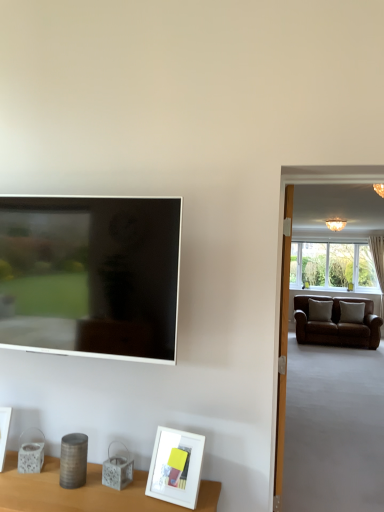
Question: Can you confirm if matte black tv at left is taller than white matte picture frame at lower left, which appears as the 2th picture frame when viewed from the right?

Choices:
 (A) yes
 (B) no

Answer: (A)

Question: Can you confirm if matte black tv at left is bigger than white matte picture frame at lower left, the 1th picture frame viewed from the back?

Choices:
 (A) no
 (B) yes

Answer: (B)

Question: Is matte black tv at left surrounding white matte picture frame at lower left, which appears as the 2th picture frame when viewed from the right?

Choices:
 (A) yes
 (B) no

Answer: (B)

Question: Are matte black tv at left and white matte picture frame at lower left, the first picture frame in the left-to-right sequence, located far from each other?

Choices:
 (A) yes
 (B) no

Answer: (B)

Question: Is matte black tv at left facing away from white matte picture frame at lower left, the first picture frame in the left-to-right sequence?

Choices:
 (A) no
 (B) yes

Answer: (A)

Question: Is matte black tv at left thinner than white matte picture frame at lower left, the 1th picture frame viewed from the back?

Choices:
 (A) yes
 (B) no

Answer: (A)

Question: Does white matte picture frame at lower center, acting as the 2th picture frame starting from the left, contain white matte picture frame at lower left, which appears as the 2th picture frame when viewed from the right?

Choices:
 (A) yes
 (B) no

Answer: (B)

Question: Is white matte picture frame at lower center, which ranks as the 1th picture frame in front-to-back order, next to white matte picture frame at lower left, the 2th picture frame when ordered from front to back, and touching it?

Choices:
 (A) yes
 (B) no

Answer: (B)

Question: Considering the relative sizes of white matte picture frame at lower center, acting as the second picture frame starting from the back, and white matte picture frame at lower left, which appears as the 2th picture frame when viewed from the right, in the image provided, is white matte picture frame at lower center, acting as the second picture frame starting from the back, taller than white matte picture frame at lower left, which appears as the 2th picture frame when viewed from the right,?

Choices:
 (A) no
 (B) yes

Answer: (B)

Question: From a real-world perspective, is white matte picture frame at lower center, which ranks as the 1th picture frame in front-to-back order, beneath white matte picture frame at lower left, the 2th picture frame when ordered from front to back?

Choices:
 (A) yes
 (B) no

Answer: (A)

Question: Considering the relative sizes of white matte picture frame at lower center, acting as the 2th picture frame starting from the left, and white matte picture frame at lower left, which appears as the 2th picture frame when viewed from the right, in the image provided, is white matte picture frame at lower center, acting as the 2th picture frame starting from the left, shorter than white matte picture frame at lower left, which appears as the 2th picture frame when viewed from the right,?

Choices:
 (A) yes
 (B) no

Answer: (B)

Question: Are white matte picture frame at lower center, acting as the 2th picture frame starting from the left, and white matte picture frame at lower left, the first picture frame in the left-to-right sequence, located far from each other?

Choices:
 (A) no
 (B) yes

Answer: (A)

Question: From a real-world perspective, is white matte picture frame at lower center, acting as the second picture frame starting from the back, physically above matte black tv at left?

Choices:
 (A) no
 (B) yes

Answer: (A)